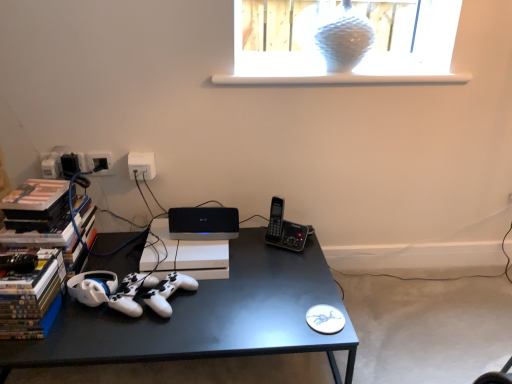
This screenshot has height=384, width=512. I want to click on vacant space underneath transparent textured glass vase at upper center (from a real-world perspective), so pos(346,70).